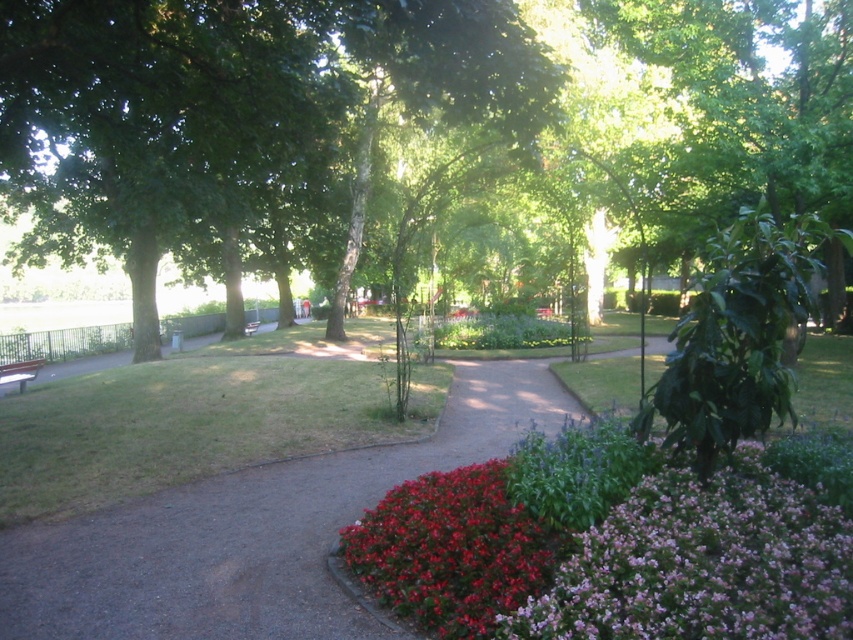
You are standing at the entrance of the park and see two points marked in the image. The first point is at coordinate point(851, 604) and the second is at point(39, 364). Which point is closer to you?

Point(851, 604) is in front of point(39, 364), so the first point is closer to you.

You are a visitor in the park and want to take a photo of both the purple textured flowers at lower right and the wooden park bench at center. Which object should you position closer to the left side of your camera frame to include both in the photo?

To include both the purple textured flowers at lower right and the wooden park bench at center in your photo, you should position the wooden park bench at center closer to the left side of your camera frame since the purple textured flowers at lower right are on the right side of the bench.